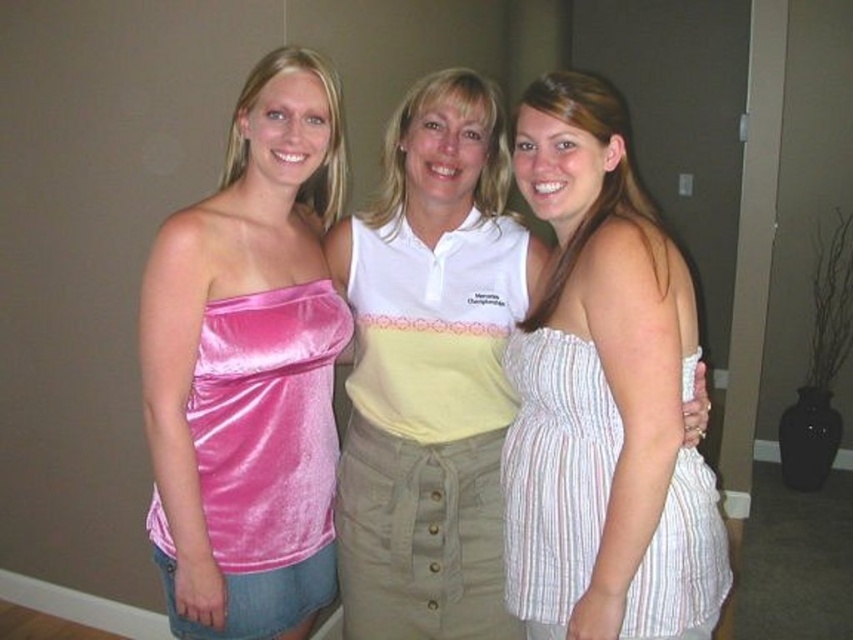
Can you confirm if white striped dress at right is smaller than pink velvet strapless dress at left?

Incorrect, white striped dress at right is not smaller in size than pink velvet strapless dress at left.

Does white striped dress at right appear on the right side of pink velvet strapless dress at left?

Indeed, white striped dress at right is positioned on the right side of pink velvet strapless dress at left.

Who is more forward, (544, 368) or (262, 298)?

Point (544, 368) is more forward.

Image resolution: width=853 pixels, height=640 pixels. What are the coordinates of `white striped dress at right` in the screenshot? It's located at (555, 474).

Is pink velvet top at left further to the viewer compared to white striped dress at right?

Yes, it is behind white striped dress at right.

Is point (210, 317) positioned behind point (537, 458)?

Yes, it is.

Locate an element on the screen. This screenshot has width=853, height=640. pink velvet top at left is located at coordinates (248, 369).

Does white cotton shirt at center appear under pink velvet strapless dress at left?

Incorrect, white cotton shirt at center is not positioned below pink velvet strapless dress at left.

Does point (341, 480) come closer to viewer compared to point (253, 349)?

That is False.

Which is behind, point (524, 228) or point (204, 476)?

Point (524, 228)

At what (x,y) coordinates should I click in order to perform the action: click on white cotton shirt at center. Please return your answer as a coordinate pair (x, y). Looking at the image, I should click on (430, 369).